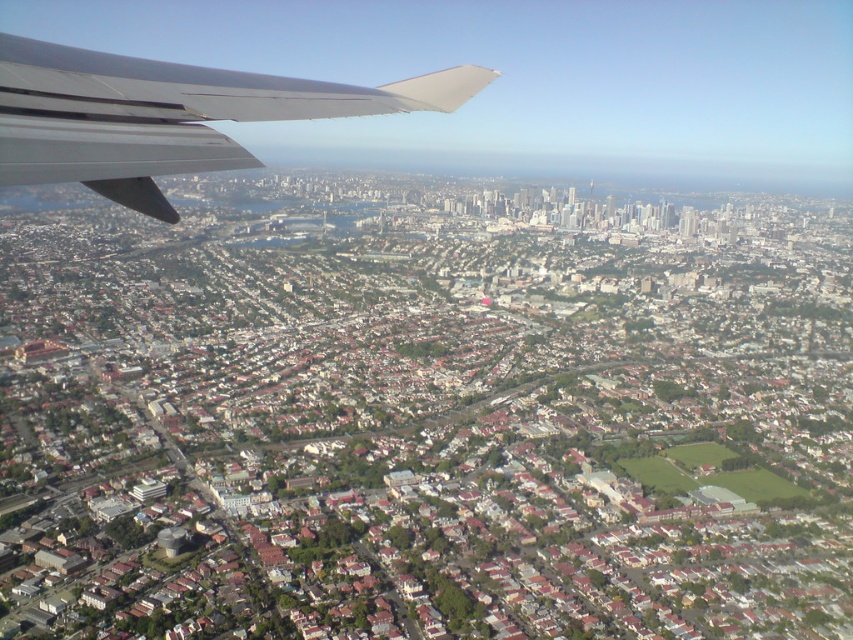
Question: Which of the following is the farthest from the observer?

Choices:
 (A) matte gray wing at upper left
 (B) metallic gray wing at upper left

Answer: (A)

Question: Does metallic gray wing at upper left have a larger size compared to matte gray wing at upper left?

Choices:
 (A) no
 (B) yes

Answer: (B)

Question: Does metallic gray wing at upper left appear on the right side of matte gray wing at upper left?

Choices:
 (A) no
 (B) yes

Answer: (B)

Question: Does metallic gray wing at upper left appear over matte gray wing at upper left?

Choices:
 (A) no
 (B) yes

Answer: (A)